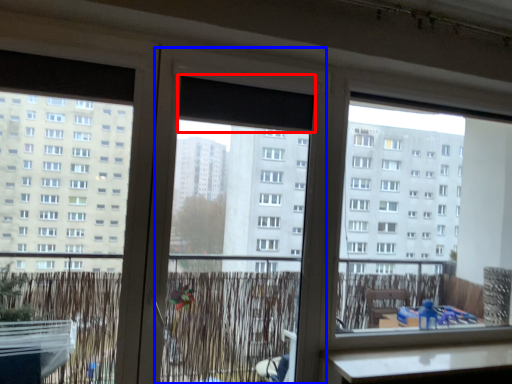
Question: Among these objects, which one is nearest to the camera, window screen (highlighted by a red box) or screen door (highlighted by a blue box)?

Choices:
 (A) window screen
 (B) screen door

Answer: (B)